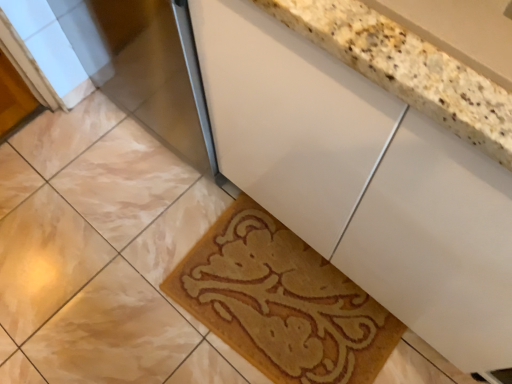
The width and height of the screenshot is (512, 384). I want to click on free space below marble tile at lower left (from a real-world perspective), so click(61, 243).